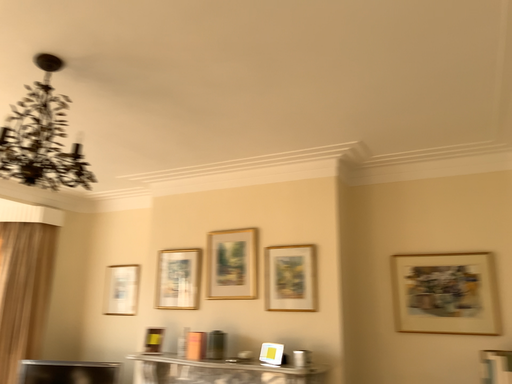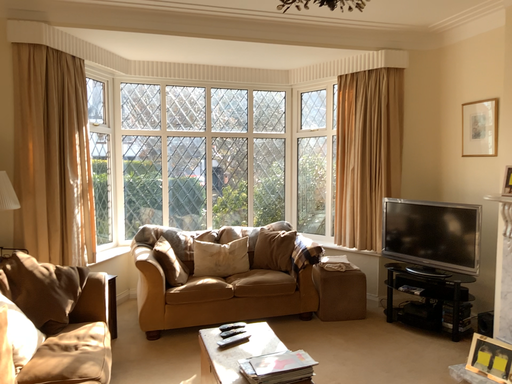
Question: Which way did the camera rotate in the video?

Choices:
 (A) rotated left
 (B) rotated right

Answer: (A)